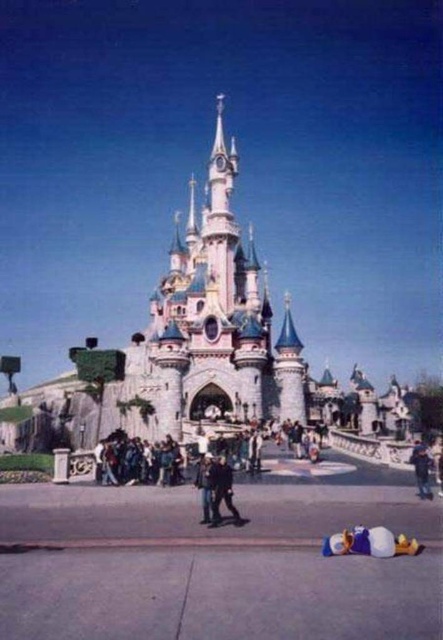
Question: Which point is farther from the camera taking this photo?

Choices:
 (A) (422, 456)
 (B) (226, 480)

Answer: (A)

Question: In this image, where is light blue stone castle at center located relative to denim pants at lower right?

Choices:
 (A) above
 (B) below

Answer: (A)

Question: In this image, where is light blue stone castle at center located relative to dark blue jeans at center?

Choices:
 (A) above
 (B) below

Answer: (A)

Question: Can you confirm if light blue stone castle at center is thinner than denim pants at lower right?

Choices:
 (A) no
 (B) yes

Answer: (A)

Question: Which of the following is the farthest from the observer?

Choices:
 (A) dark blue jeans at center
 (B) light blue stone castle at center

Answer: (B)

Question: Which of the following is the farthest from the observer?

Choices:
 (A) (420, 472)
 (B) (233, 401)
 (C) (213, 481)

Answer: (B)